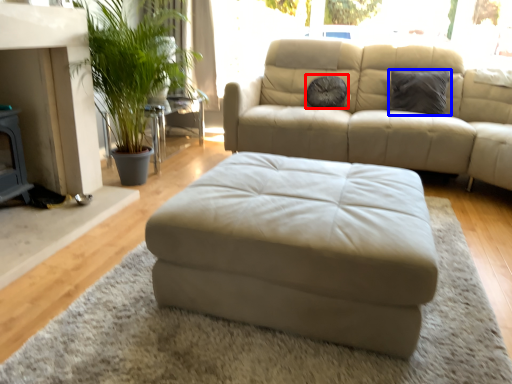
Question: Which of the following is the closest to the observer, pillow (highlighted by a red box) or pillow (highlighted by a blue box)?

Choices:
 (A) pillow
 (B) pillow

Answer: (B)